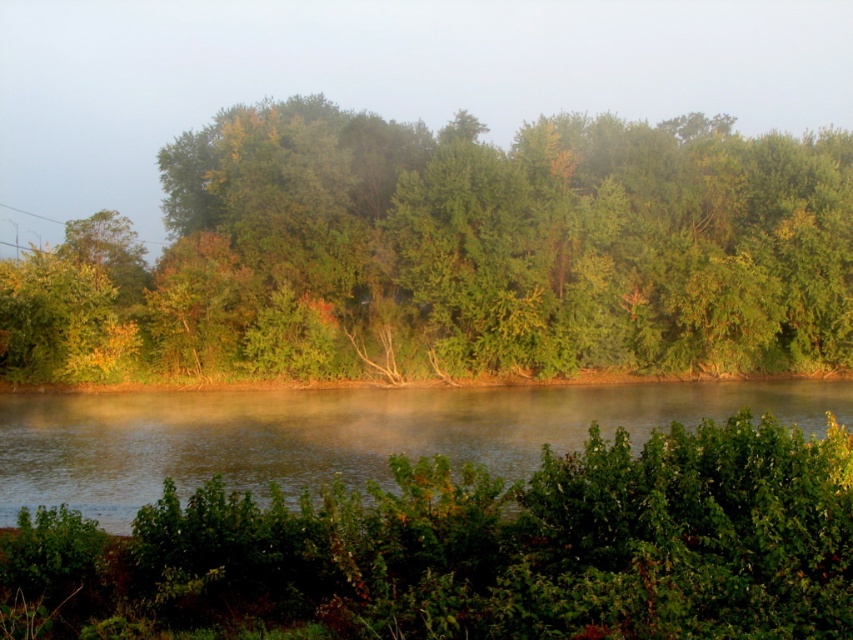
Is green matte trees at center to the right of foggy mist at upper center from the viewer's perspective?

Indeed, green matte trees at center is positioned on the right side of foggy mist at upper center.

Is green matte trees at center smaller than foggy mist at upper center?

Yes, green matte trees at center is smaller than foggy mist at upper center.

What do you see at coordinates (451, 253) in the screenshot? The image size is (853, 640). I see `green matte trees at center` at bounding box center [451, 253].

Locate an element on the screen. Image resolution: width=853 pixels, height=640 pixels. green matte trees at center is located at coordinates (451, 253).

Can you confirm if green matte trees at center is positioned to the right of smooth water at center?

Yes, green matte trees at center is to the right of smooth water at center.

Between point (83, 344) and point (71, 428), which one is positioned in front?

Point (71, 428) is in front.

Where is `green matte trees at center`? This screenshot has height=640, width=853. green matte trees at center is located at coordinates (451, 253).

Who is lower down, foggy mist at upper center or smooth water at center?

smooth water at center

Is foggy mist at upper center below smooth water at center?

Actually, foggy mist at upper center is above smooth water at center.

The width and height of the screenshot is (853, 640). In order to click on foggy mist at upper center in this screenshot , I will do `click(379, 76)`.